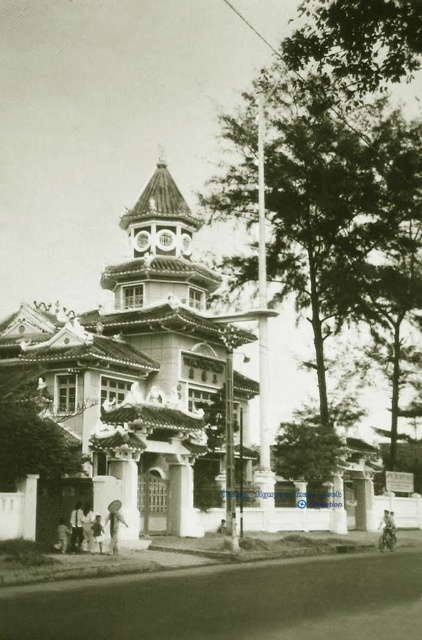
From the picture: Is smooth stone bell tower at center behind white stone pillar at center?

No, smooth stone bell tower at center is closer to the viewer.

The height and width of the screenshot is (640, 422). Identify the location of smooth stone bell tower at center. (159, 250).

This screenshot has width=422, height=640. Identify the location of smooth stone bell tower at center. (159, 250).

Identify the location of smooth stone bell tower at center. (159, 250).

Who is lower down, white stone pillar at center or white concrete pillar at center?

white stone pillar at center is lower down.

Where is `white stone pillar at center`? This screenshot has width=422, height=640. white stone pillar at center is located at coordinates (337, 504).

Can you confirm if white concrete pillar at center is taller than metallic silver motorcycle at lower right?

Incorrect, white concrete pillar at center's height is not larger of metallic silver motorcycle at lower right's.

Is white concrete pillar at center to the right of metallic silver motorcycle at lower right from the viewer's perspective?

In fact, white concrete pillar at center is to the left of metallic silver motorcycle at lower right.

Does point (305, 513) come farther from viewer compared to point (389, 540)?

Yes.

Identify the location of white concrete pillar at center. (300, 500).